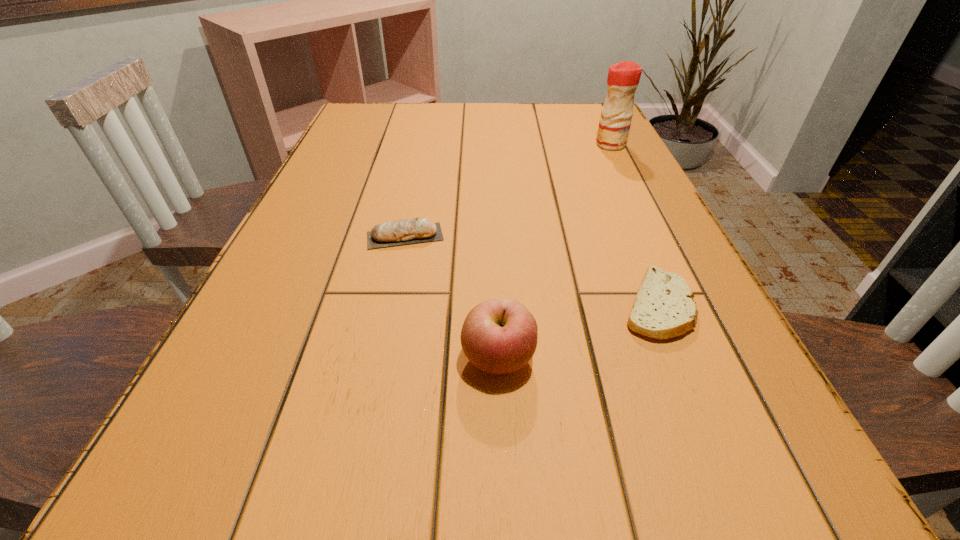
At what (x,y) coordinates should I click in order to perform the action: click on the farthest object. Please return your answer as a coordinate pair (x, y). Looking at the image, I should click on (x=623, y=78).

Locate an element on the screen. Image resolution: width=960 pixels, height=540 pixels. condiment is located at coordinates (623, 78).

At what (x,y) coordinates should I click in order to perform the action: click on the third object from right to left. Please return your answer as a coordinate pair (x, y). This screenshot has width=960, height=540. Looking at the image, I should click on (499, 336).

Find the location of a particular element. This screenshot has height=540, width=960. the second tallest object is located at coordinates click(499, 336).

The height and width of the screenshot is (540, 960). I want to click on the third tallest object, so click(406, 231).

Where is `the taller pita bread`? the taller pita bread is located at coordinates (406, 231).

This screenshot has height=540, width=960. I want to click on the shorter pita bread, so click(663, 308).

This screenshot has height=540, width=960. I want to click on the shortest object, so click(x=663, y=308).

At what (x,y) coordinates should I click in order to perform the action: click on vacant space situated 0.070m on the back of the farthest object. Please return your answer as a coordinate pair (x, y). This screenshot has height=540, width=960. Looking at the image, I should click on (602, 128).

You are a GUI agent. You are given a task and a screenshot of the screen. Output one action in this format:
    pyautogui.click(x=<x>, y=<y>)
    Task: Click on the blank space located 0.150m on the front of the third shortest object
    
    Given the screenshot: What is the action you would take?
    pyautogui.click(x=504, y=500)